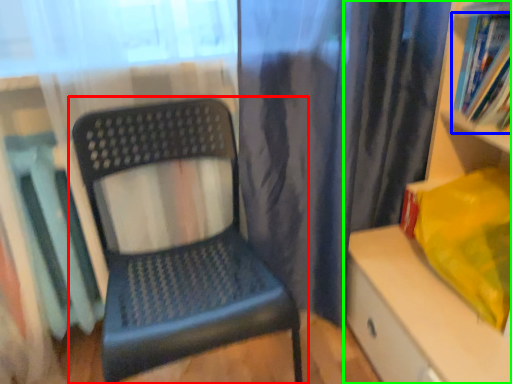
Question: Which object is the farthest from chair (highlighted by a red box)? Choose among these: book (highlighted by a blue box) or shelf (highlighted by a green box).

Choices:
 (A) book
 (B) shelf

Answer: (A)